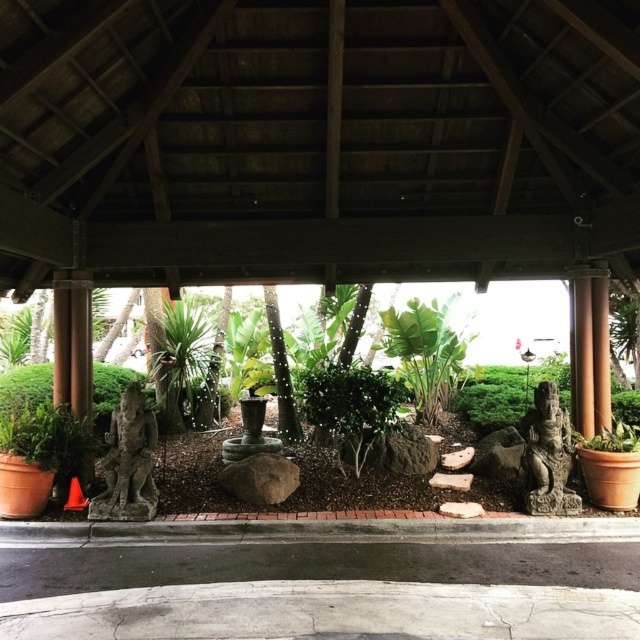
Between gray stone statue at lower left and stone statue at center, which one has more height?

Standing taller between the two is gray stone statue at lower left.

Who is more distant from viewer, (x=99, y=499) or (x=579, y=499)?

Positioned behind is point (x=579, y=499).

The height and width of the screenshot is (640, 640). What are the coordinates of `gray stone statue at lower left` in the screenshot? It's located at (128, 461).

In order to click on gray stone statue at lower left in this screenshot , I will do `click(128, 461)`.